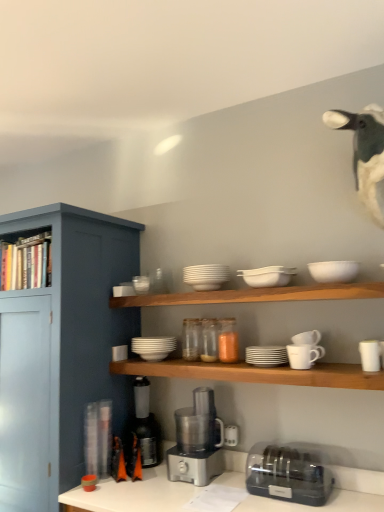
Question: From the image's perspective, would you say white matte bowls at center, placed as the fourth tableware when sorted from left to right, is shown under white fabric duck at upper right?

Choices:
 (A) no
 (B) yes

Answer: (B)

Question: Does white matte bowls at center, the sixth tableware in the right-to-left sequence, turn towards white fabric duck at upper right?

Choices:
 (A) no
 (B) yes

Answer: (A)

Question: Can you confirm if white matte bowls at center, placed as the fourth tableware when sorted from left to right, is thinner than white fabric duck at upper right?

Choices:
 (A) no
 (B) yes

Answer: (B)

Question: Is white matte bowls at center, placed as the fourth tableware when sorted from left to right, oriented away from white fabric duck at upper right?

Choices:
 (A) no
 (B) yes

Answer: (A)

Question: From a real-world perspective, is white matte bowls at center, placed as the fourth tableware when sorted from left to right, located higher than white fabric duck at upper right?

Choices:
 (A) yes
 (B) no

Answer: (B)

Question: Visually, is wooden bookshelf at left, arranged as the 1th shelf when viewed from the top, positioned to the left or to the right of white matte bowl at upper right, arranged as the 2th tableware when viewed from the right?

Choices:
 (A) left
 (B) right

Answer: (A)

Question: Does point (36, 246) appear closer or farther from the camera than point (342, 266)?

Choices:
 (A) closer
 (B) farther

Answer: (B)

Question: From a real-world perspective, is wooden bookshelf at left, the third shelf from the bottom, physically located above or below white matte bowl at upper right, the 8th tableware viewed from the left?

Choices:
 (A) above
 (B) below

Answer: (A)

Question: From the image's perspective, is wooden bookshelf at left, the third shelf from the bottom, above or below white matte bowl at upper right, arranged as the 2th tableware when viewed from the right?

Choices:
 (A) below
 (B) above

Answer: (B)

Question: From a real-world perspective, relative to white matte bowls at center, placed as the fourth tableware when sorted from left to right, is white matte cup at right, the 9th tableware from the left, vertically above or below?

Choices:
 (A) below
 (B) above

Answer: (A)

Question: Based on their positions, is white matte cup at right, placed as the 1th tableware when sorted from right to left, located to the left or right of white matte bowls at center, the sixth tableware in the right-to-left sequence?

Choices:
 (A) right
 (B) left

Answer: (A)

Question: In terms of height, does white matte cup at right, the 9th tableware from the left, look taller or shorter compared to white matte bowls at center, placed as the fourth tableware when sorted from left to right?

Choices:
 (A) tall
 (B) short

Answer: (A)

Question: Is point (367, 357) closer or farther from the camera than point (253, 279)?

Choices:
 (A) farther
 (B) closer

Answer: (B)

Question: Is translucent glass jar at center, positioned as the eighth tableware in right-to-left order, taller or shorter than white matte cup at right, placed as the 1th tableware when sorted from right to left?

Choices:
 (A) tall
 (B) short

Answer: (A)

Question: Considering the positions of translucent glass jar at center, the second tableware in the left-to-right sequence, and white matte cup at right, the 9th tableware from the left, in the image, is translucent glass jar at center, the second tableware in the left-to-right sequence, wider or thinner than white matte cup at right, the 9th tableware from the left,?

Choices:
 (A) thin
 (B) wide

Answer: (B)